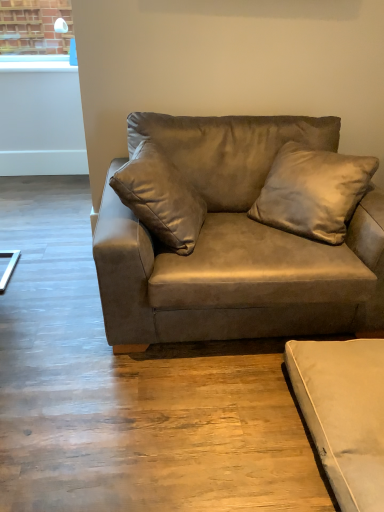
Question: Which direction should I rotate to face suede brown couch at center, which is the 2th studio couch in bottom-to-top order, — up or down?

Choices:
 (A) up
 (B) down

Answer: (A)

Question: Does beige suede studio couch at lower right, which is the 1th studio couch from bottom to top, appear on the right side of suede-like beige pillow at upper center?

Choices:
 (A) no
 (B) yes

Answer: (B)

Question: From the image's perspective, is beige suede studio couch at lower right, which is the 1th studio couch from bottom to top, under suede-like beige pillow at upper center?

Choices:
 (A) no
 (B) yes

Answer: (B)

Question: Considering the relative sizes of beige suede studio couch at lower right, which is the 1th studio couch from bottom to top, and suede-like beige pillow at upper center in the image provided, is beige suede studio couch at lower right, which is the 1th studio couch from bottom to top, wider than suede-like beige pillow at upper center?

Choices:
 (A) yes
 (B) no

Answer: (A)

Question: Can you confirm if beige suede studio couch at lower right, which appears as the 2th studio couch when viewed from the top, is taller than suede-like beige pillow at upper center?

Choices:
 (A) no
 (B) yes

Answer: (A)

Question: Is there a large distance between beige suede studio couch at lower right, which appears as the 2th studio couch when viewed from the top, and suede-like beige pillow at upper center?

Choices:
 (A) yes
 (B) no

Answer: (B)

Question: Is beige suede studio couch at lower right, which appears as the 2th studio couch when viewed from the top, positioned behind suede-like beige pillow at upper center?

Choices:
 (A) yes
 (B) no

Answer: (B)

Question: Is suede brown couch at center, which is the 2th studio couch in bottom-to-top order, placed right next to suede-like beige pillow at upper center?

Choices:
 (A) no
 (B) yes

Answer: (A)

Question: From the image's perspective, is suede brown couch at center, placed as the first studio couch when sorted from top to bottom, located beneath suede-like beige pillow at upper center?

Choices:
 (A) yes
 (B) no

Answer: (A)

Question: Is suede brown couch at center, placed as the first studio couch when sorted from top to bottom, positioned before suede-like beige pillow at upper center?

Choices:
 (A) yes
 (B) no

Answer: (A)

Question: Is suede brown couch at center, placed as the first studio couch when sorted from top to bottom, far from suede-like beige pillow at upper center?

Choices:
 (A) yes
 (B) no

Answer: (B)

Question: From the image's perspective, is suede brown couch at center, placed as the first studio couch when sorted from top to bottom, located above suede-like beige pillow at upper center?

Choices:
 (A) yes
 (B) no

Answer: (B)

Question: Can you confirm if suede brown couch at center, placed as the first studio couch when sorted from top to bottom, is thinner than suede-like beige pillow at upper center?

Choices:
 (A) no
 (B) yes

Answer: (A)

Question: Is beige suede studio couch at lower right, which is the 1th studio couch from bottom to top, completely or partially outside of suede brown couch at center, which is the 2th studio couch in bottom-to-top order?

Choices:
 (A) yes
 (B) no

Answer: (A)